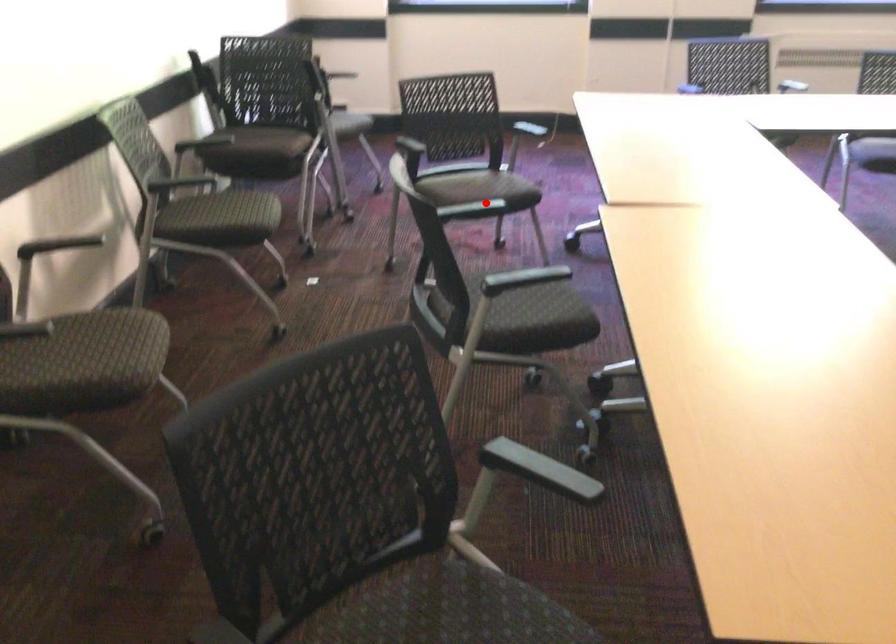
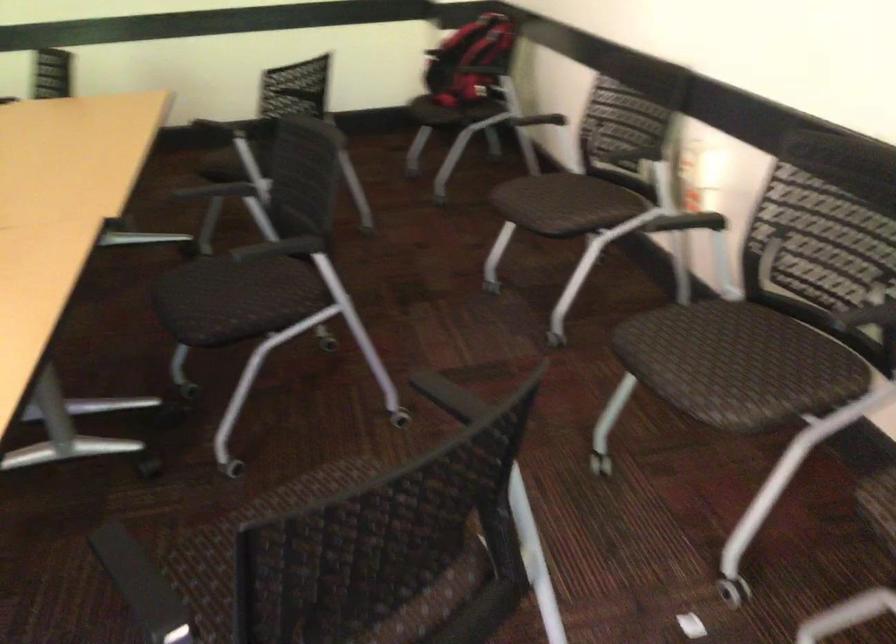
In the second image, find the point that corresponds to the highlighted location in the first image.

(313, 487)